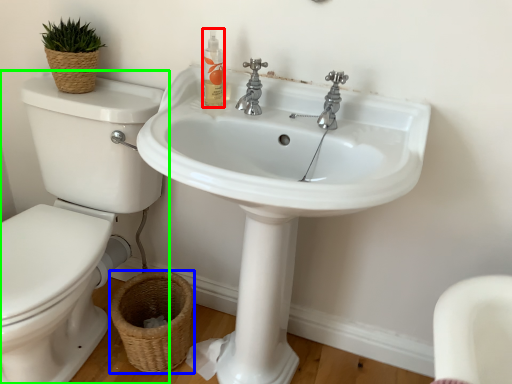
Question: Estimate the real-world distances between objects in this image. Which object is farther from cleaning product (highlighted by a red box), basket (highlighted by a blue box) or toilet (highlighted by a green box)?

Choices:
 (A) basket
 (B) toilet

Answer: (A)